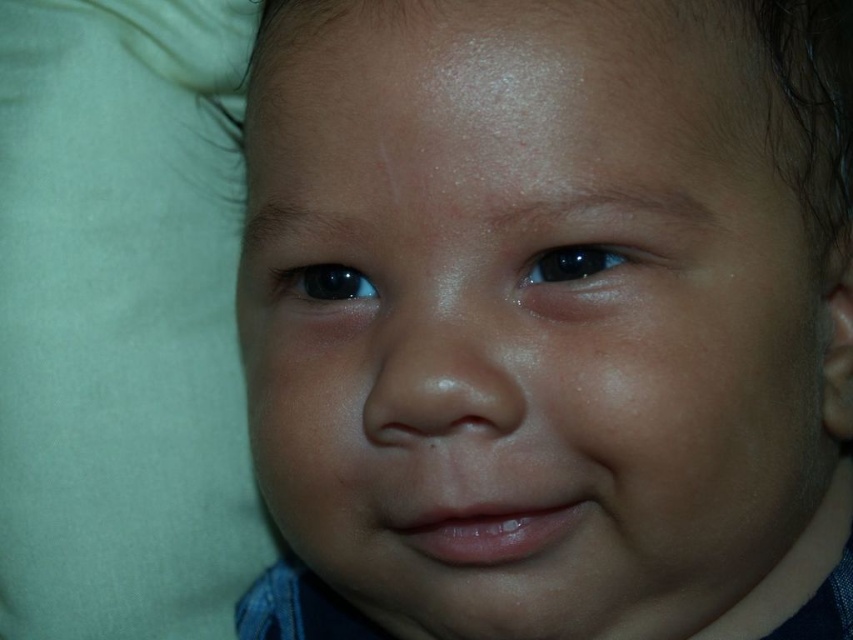
Question: Which object is the closest to the smooth skin baby at center?

Choices:
 (A) glossy black eye at upper center
 (B) black glossy eye at upper center

Answer: (B)

Question: Which object appears farthest from the camera in this image?

Choices:
 (A) black glossy eye at upper center
 (B) smooth skin baby at center

Answer: (A)

Question: Which is nearer to the black glossy eye at upper center?

Choices:
 (A) smooth skin baby at center
 (B) glossy black eye at upper center

Answer: (A)

Question: Does smooth skin baby at center have a larger size compared to black glossy eye at upper center?

Choices:
 (A) no
 (B) yes

Answer: (B)

Question: Is black glossy eye at upper center positioned before glossy black eye at upper center?

Choices:
 (A) yes
 (B) no

Answer: (A)

Question: Does smooth skin baby at center appear over black glossy eye at upper center?

Choices:
 (A) yes
 (B) no

Answer: (B)